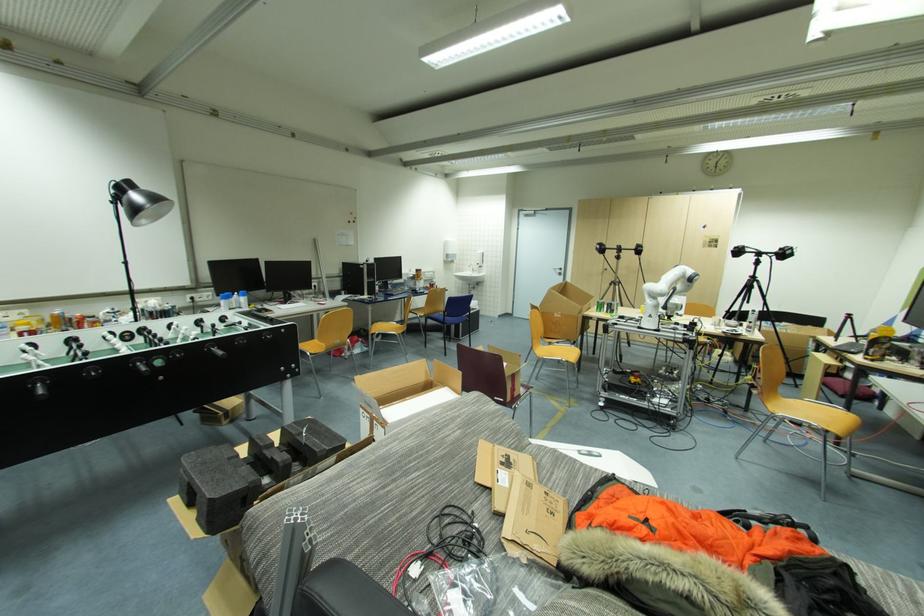
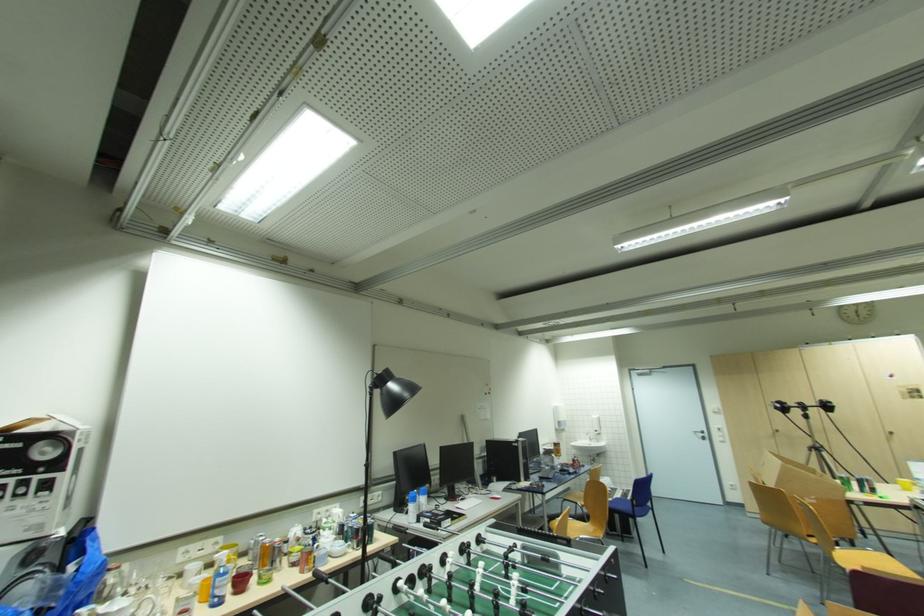
In the second image, find the point that corresponds to point 450,315 in the first image.

(639, 506)